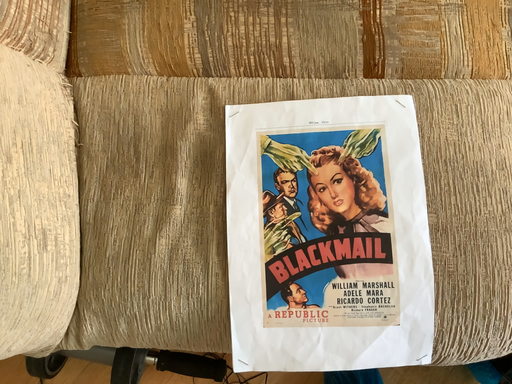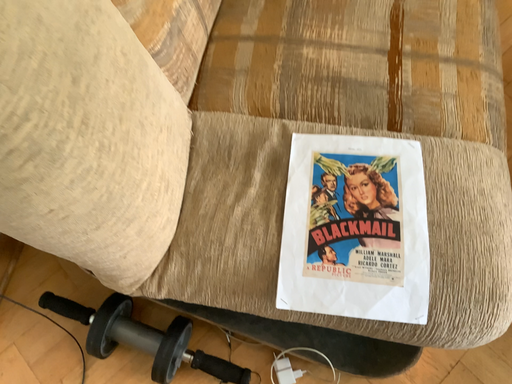
Question: How did the camera likely rotate when shooting the video?

Choices:
 (A) rotated downward
 (B) rotated upward

Answer: (B)